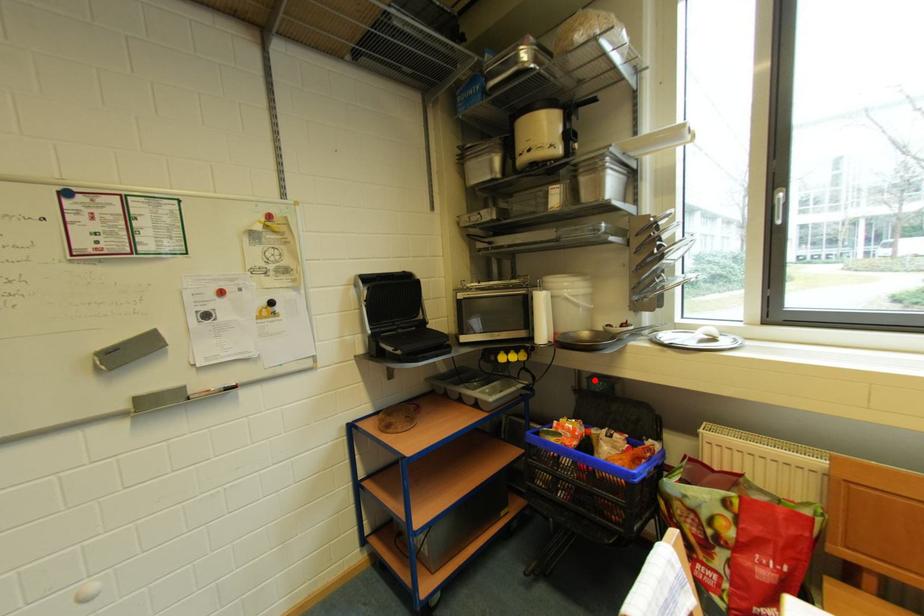
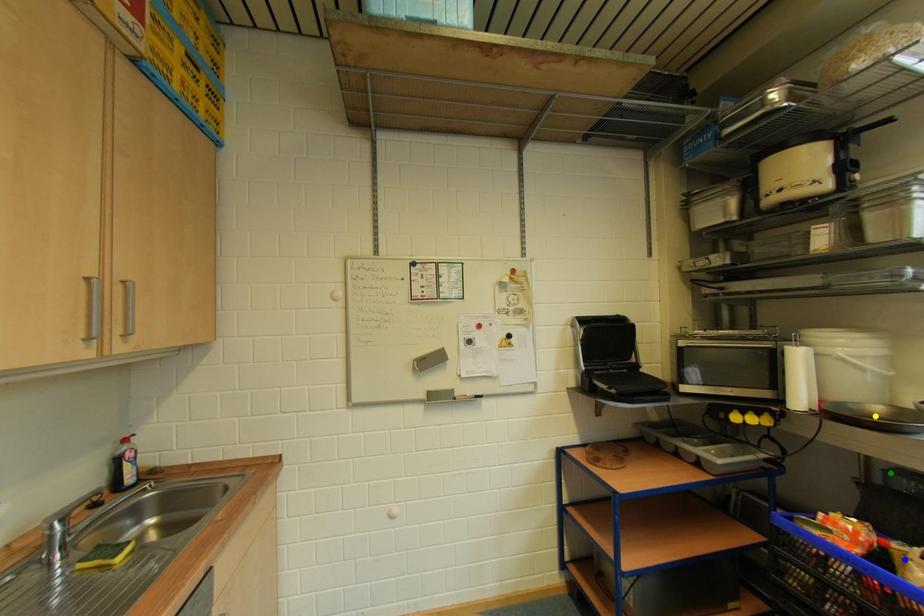
Question: I am providing you with two images of the same scene from different viewpoints. A red point is marked on the first image. You are given multiple points on the second image. Which spot in image 2 lines up with the point in image 1?

Choices:
 (A) green point
 (B) yellow point
 (C) blue point

Answer: (A)